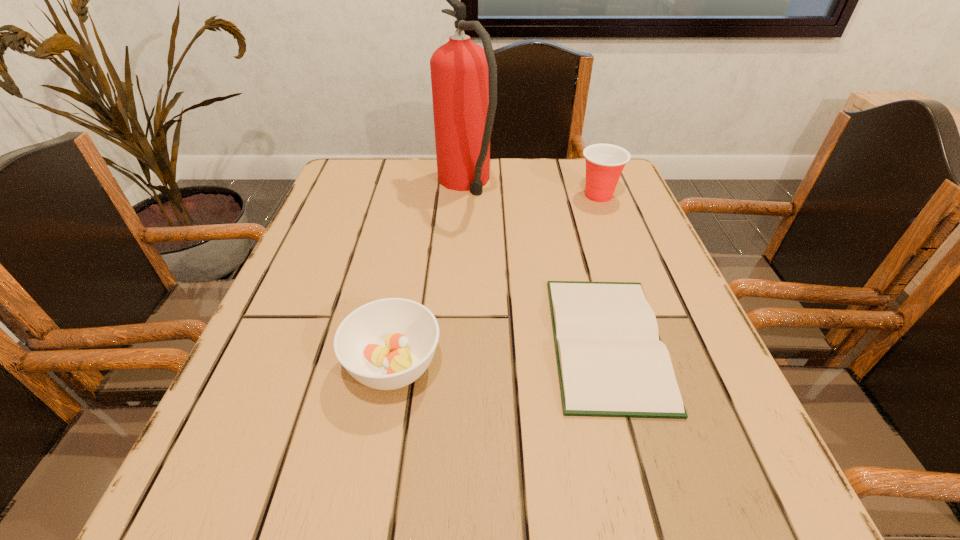
The height and width of the screenshot is (540, 960). I want to click on free space between the cup and the fire extinguisher, so click(x=532, y=190).

At what (x,y) coordinates should I click in order to perform the action: click on unoccupied area between the tallest object and the third shortest object. Please return your answer as a coordinate pair (x, y). This screenshot has width=960, height=540. Looking at the image, I should click on (532, 190).

Where is `vacant area that lies between the shortest object and the cup`? This screenshot has width=960, height=540. vacant area that lies between the shortest object and the cup is located at coordinates (603, 268).

Locate an element on the screen. The width and height of the screenshot is (960, 540). vacant point located between the hardback book and the tallest object is located at coordinates (536, 263).

In order to click on free point between the third tallest object and the cup in this screenshot , I will do [x=496, y=280].

Image resolution: width=960 pixels, height=540 pixels. Identify the location of free area in between the cup and the fire extinguisher. (532, 190).

Find the location of a particular element. The width and height of the screenshot is (960, 540). free space between the hardback book and the second tallest object is located at coordinates (603, 268).

You are a GUI agent. You are given a task and a screenshot of the screen. Output one action in this format:
    pyautogui.click(x=<x>, y=<y>)
    Task: Click on the free space between the hardback book and the second shortest object
    This screenshot has width=960, height=540.
    Given the screenshot: What is the action you would take?
    pyautogui.click(x=500, y=354)

Identify the location of vacant area that lies between the hardback book and the third shortest object. (603, 268).

This screenshot has width=960, height=540. In order to click on the closest object to the third tallest object in this screenshot , I will do `click(611, 361)`.